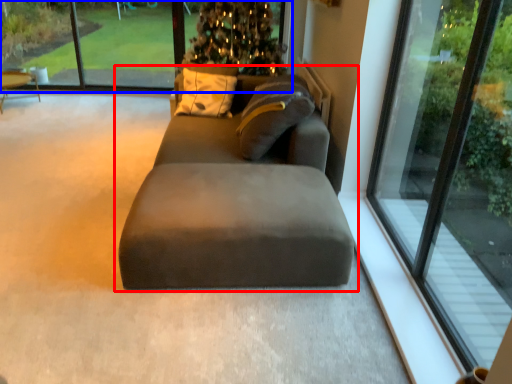
Question: Among these objects, which one is farthest to the camera, studio couch (highlighted by a red box) or window screen (highlighted by a blue box)?

Choices:
 (A) studio couch
 (B) window screen

Answer: (B)